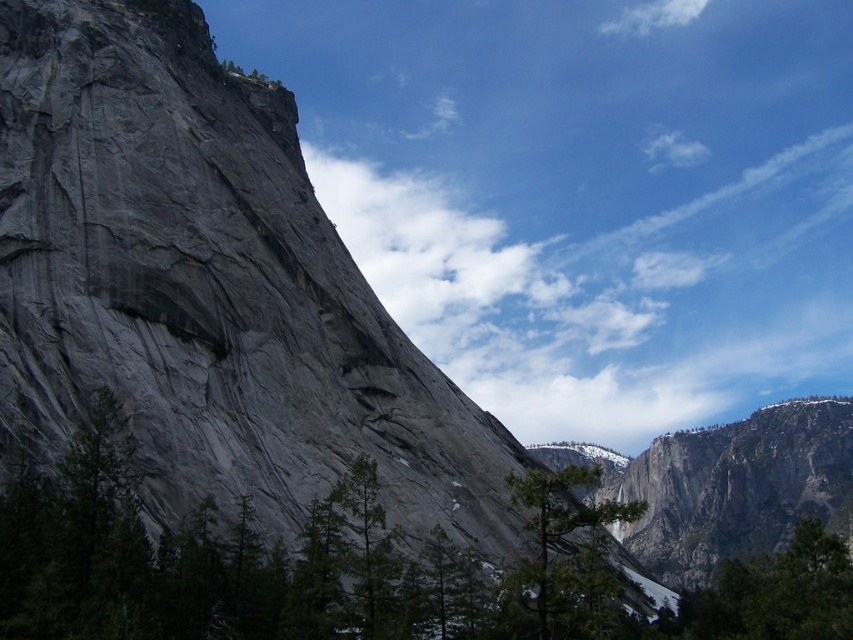
You are a GUI agent. You are given a task and a screenshot of the screen. Output one action in this format:
    pyautogui.click(x=<x>, y=<y>)
    Task: Click on the green matte tree at center
    Image resolution: width=853 pixels, height=640 pixels.
    Given the screenshot: What is the action you would take?
    pyautogui.click(x=567, y=554)

Can you confirm if green matte tree at center is smaller than green matte tree at lower right?

Indeed, green matte tree at center has a smaller size compared to green matte tree at lower right.

Is point (567, 595) behind point (839, 616)?

No, it is in front of (839, 616).

What are the coordinates of `green matte tree at center` in the screenshot? It's located at (567, 554).

Is green matte tree at center shorter than white fluffy cloud at upper center?

Indeed, green matte tree at center has a lesser height compared to white fluffy cloud at upper center.

Can you confirm if green matte tree at center is positioned above white fluffy cloud at upper center?

No.

Where is `green matte tree at center`? green matte tree at center is located at coordinates (567, 554).

The image size is (853, 640). I want to click on green matte tree at center, so click(567, 554).

Between green matte tree at lower right and white fluffy cloud at upper center, which one has less height?

white fluffy cloud at upper center

Is green matte tree at lower right shorter than white fluffy cloud at upper center?

No, green matte tree at lower right is not shorter than white fluffy cloud at upper center.

The image size is (853, 640). Describe the element at coordinates (775, 593) in the screenshot. I see `green matte tree at lower right` at that location.

Where is `green matte tree at lower right`? green matte tree at lower right is located at coordinates (775, 593).